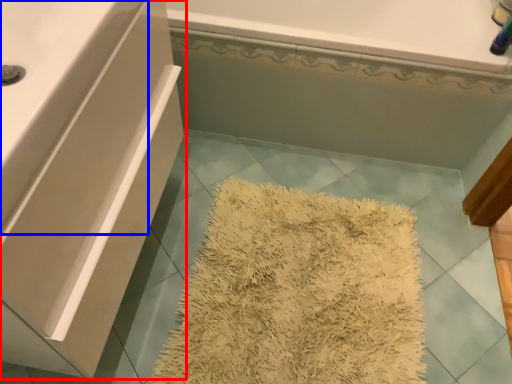
Question: Among these objects, which one is farthest to the camera, bathroom cabinet (highlighted by a red box) or counter top (highlighted by a blue box)?

Choices:
 (A) bathroom cabinet
 (B) counter top

Answer: (A)